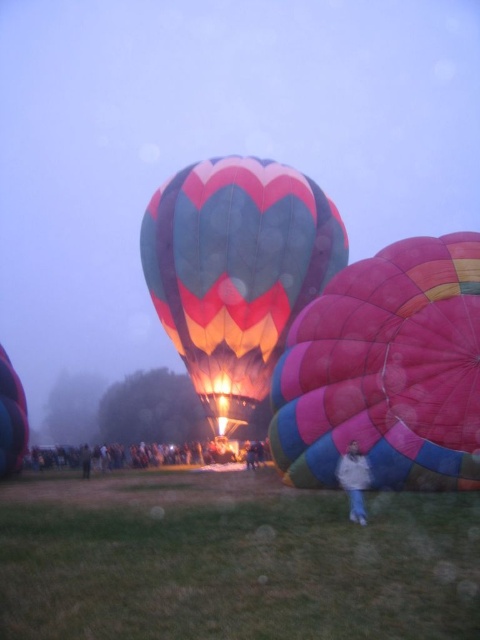
Looking at this image, you are a photographer standing on the green grass at lower center, aiming to capture the multicolored fabric balloon at center in your shot. Considering the width of the grass area and the balloon, will the balloon appear wider or narrower in the photo compared to the grass?

A: The green grass at lower center is wider than the multicolored fabric balloon at center. Therefore, the balloon will appear narrower in the photo compared to the grass.

You are standing in the grassy field at the hot air balloon festival and see the matte pink balloon at left and the white cotton jacket at lower center. Which object is closer to you?

The matte pink balloon at left is closer to you than the white cotton jacket at lower center because the jacket is behind the balloon.